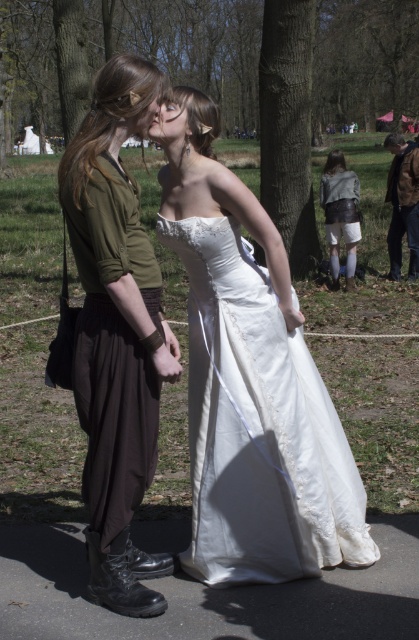
Does matte green shirt at center have a larger size compared to brown leather jacket at right?

Incorrect, matte green shirt at center is not larger than brown leather jacket at right.

Consider the image. Which is more to the right, matte green shirt at center or brown leather jacket at right?

brown leather jacket at right is more to the right.

The width and height of the screenshot is (419, 640). I want to click on matte green shirt at center, so 116,332.

Which of these two, satin white dress at center or brown leather jacket at right, stands shorter?

satin white dress at center is shorter.

Is satin white dress at center shorter than brown leather jacket at right?

Indeed, satin white dress at center has a lesser height compared to brown leather jacket at right.

Measure the distance between satin white dress at center and camera.

11.02 feet

Locate an element on the screen. The height and width of the screenshot is (640, 419). satin white dress at center is located at coordinates (258, 426).

Is matte white dress at center in front of matte green shirt at center?

No.

Can you confirm if matte white dress at center is positioned to the right of matte green shirt at center?

Correct, you'll find matte white dress at center to the right of matte green shirt at center.

Does point (307, 349) lie behind point (137, 465)?

Yes, point (307, 349) is behind point (137, 465).

Locate an element on the screen. matte white dress at center is located at coordinates (250, 380).